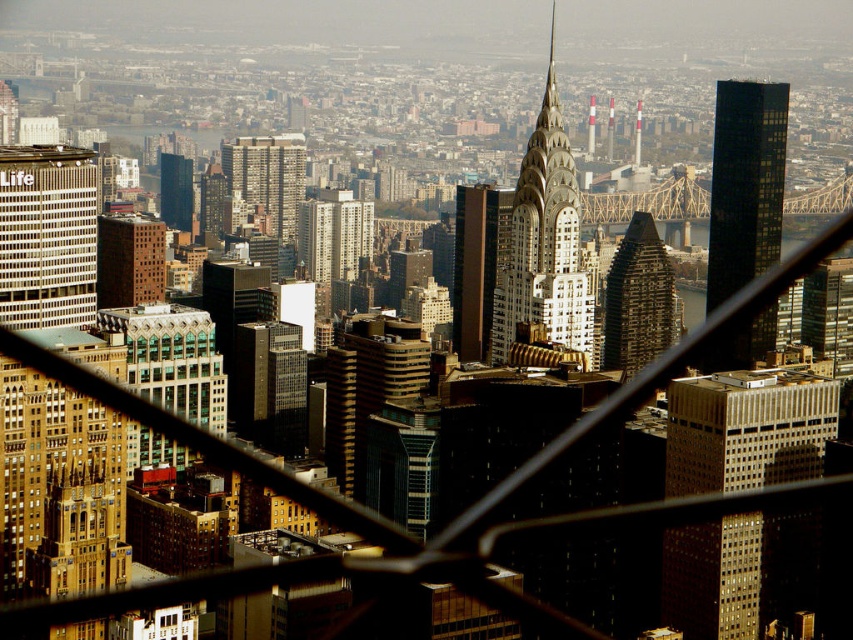
Can you confirm if gold textured building at center is positioned above shiny metallic skyscraper at center-right?

Correct, gold textured building at center is located above shiny metallic skyscraper at center-right.

From the picture: Is gold textured building at center positioned behind shiny metallic skyscraper at center-right?

No, it is in front of shiny metallic skyscraper at center-right.

Describe the element at coordinates (544, 241) in the screenshot. The image size is (853, 640). I see `gold textured building at center` at that location.

Locate an element on the screen. gold textured building at center is located at coordinates (544, 241).

Can you confirm if shiny metallic skyscraper at center-right is taller than brown brick building at center?

Indeed, shiny metallic skyscraper at center-right has a greater height compared to brown brick building at center.

Between shiny metallic skyscraper at center-right and brown brick building at center, which one has more height?

Standing taller between the two is shiny metallic skyscraper at center-right.

Is point (635, 228) in front of point (260, 164)?

No, it is behind (260, 164).

Find the location of `shiny metallic skyscraper at center-right`. shiny metallic skyscraper at center-right is located at coordinates (637, 298).

Is gold reflective glass skyscraper at center-right bigger than brown glass skyscraper at center?

Yes.

Consider the image. Who is higher up, gold reflective glass skyscraper at center-right or brown glass skyscraper at center?

brown glass skyscraper at center is higher up.

Is point (737, 564) in front of point (495, 237)?

No.

Locate an element on the screen. Image resolution: width=853 pixels, height=640 pixels. gold reflective glass skyscraper at center-right is located at coordinates (746, 429).